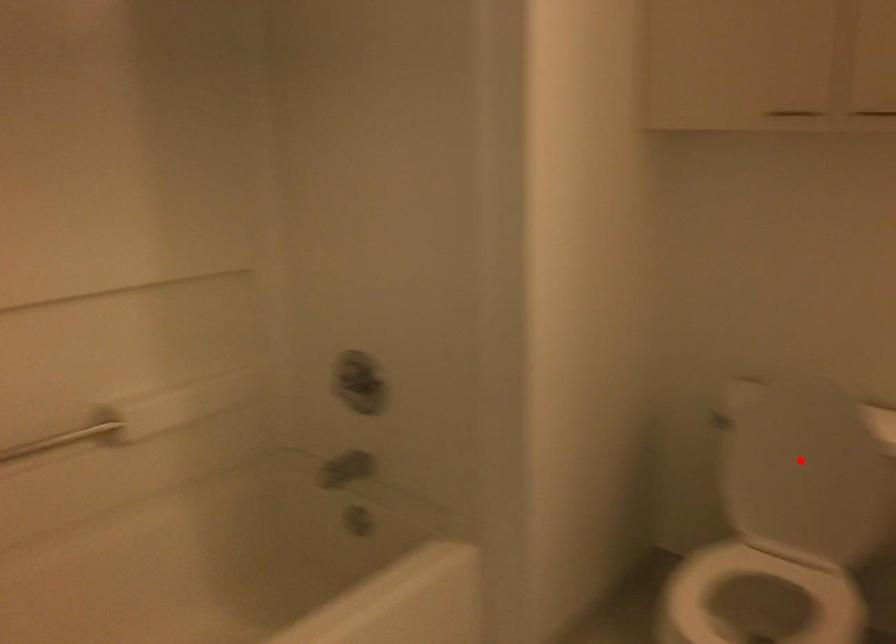
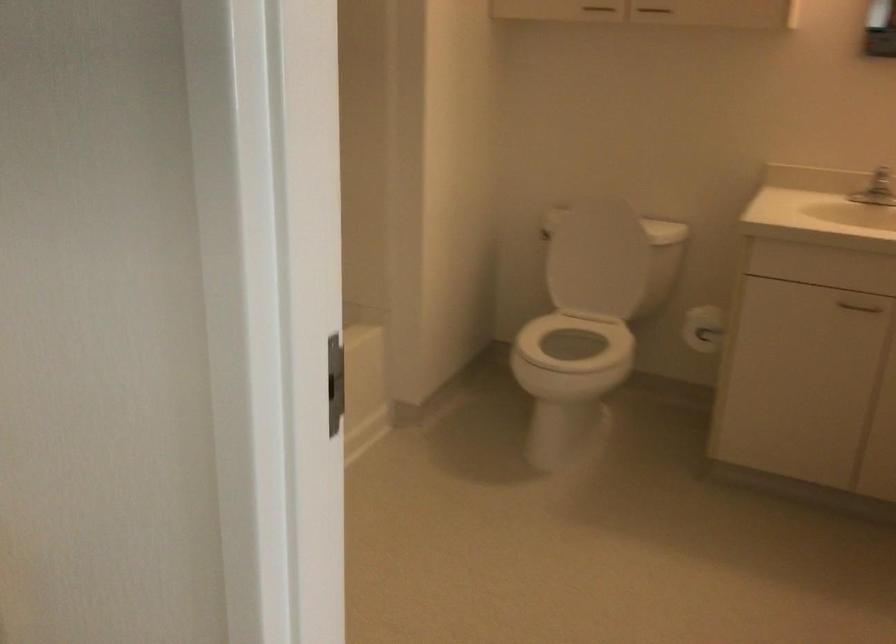
The point at the highlighted location is marked in the first image. Where is the corresponding point in the second image?

(596, 258)